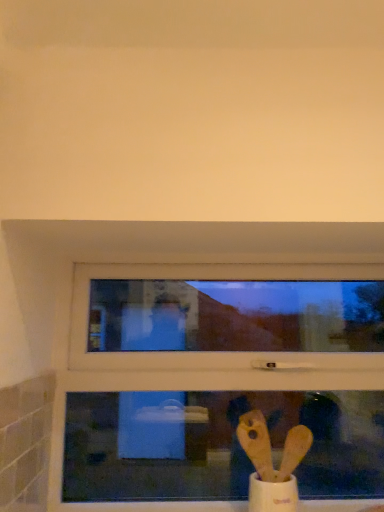
Question: Should I look upward or downward to see transparent glass window at center?

Choices:
 (A) down
 (B) up

Answer: (A)